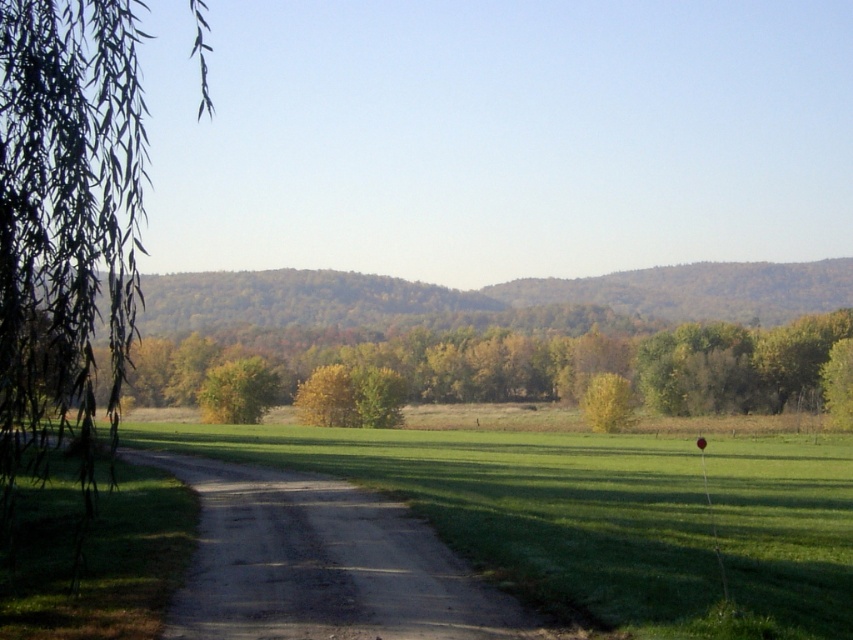
Measure the distance between yellow-green leafy tree at center-right and camera.

The distance of yellow-green leafy tree at center-right from camera is 241.14 feet.

Does yellow-green leafy tree at center-right have a greater height compared to green leafy tree at right?

Incorrect, yellow-green leafy tree at center-right's height is not larger of green leafy tree at right's.

Who is more forward, (598, 385) or (846, 401)?

Point (846, 401) is in front.

Find the location of `yellow-green leafy tree at center-right`. yellow-green leafy tree at center-right is located at coordinates (606, 403).

Measure the distance from green grass at center to yellow-green leafy tree at center.

The distance of green grass at center from yellow-green leafy tree at center is 25.93 meters.

Between point (845, 586) and point (212, 394), which one is positioned behind?

The point (212, 394) is behind.

This screenshot has width=853, height=640. Identify the location of green grass at center. (601, 516).

Does green grass at center appear on the left side of yellow-green leafy tree at center-right?

Yes, green grass at center is to the left of yellow-green leafy tree at center-right.

Does point (434, 460) come farther from viewer compared to point (619, 413)?

No, (434, 460) is in front of (619, 413).

Does point (750, 460) come in front of point (608, 378)?

That is True.

This screenshot has width=853, height=640. I want to click on green grass at center, so click(601, 516).